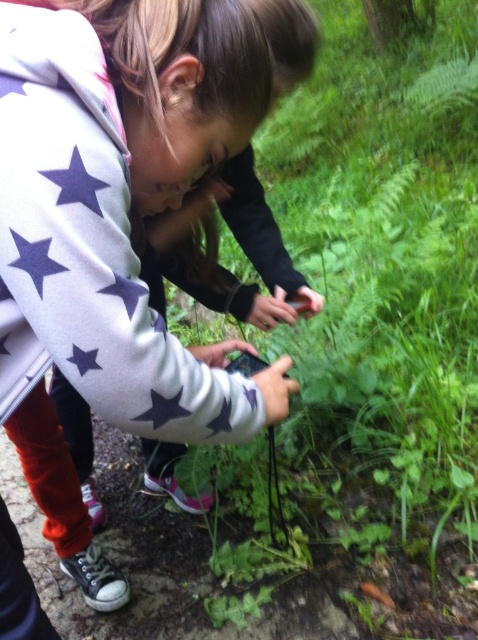
Question: Among these points, which one is farthest from the camera?

Choices:
 (A) (21, 321)
 (B) (438, 269)

Answer: (B)

Question: Which point is closer to the camera?

Choices:
 (A) green leafy plant at center
 (B) white star-patterned hoodie at center

Answer: (B)

Question: Is green leafy plant at center behind white star-patterned hoodie at center?

Choices:
 (A) yes
 (B) no

Answer: (A)

Question: Is green leafy plant at center bigger than white star-patterned hoodie at center?

Choices:
 (A) yes
 (B) no

Answer: (A)

Question: Among these points, which one is nearest to the camera?

Choices:
 (A) (176, 115)
 (B) (217, 490)

Answer: (A)

Question: From the image, what is the correct spatial relationship of green leafy plant at center in relation to white star-patterned hoodie at center?

Choices:
 (A) right
 (B) left

Answer: (A)